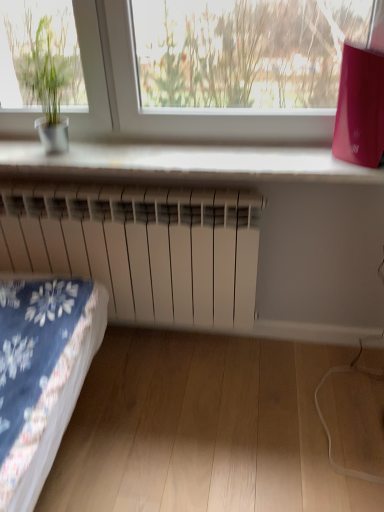
In order to click on vacant space underneath white matte radiator at center (from a real-world perspective) in this screenshot , I will do `click(163, 341)`.